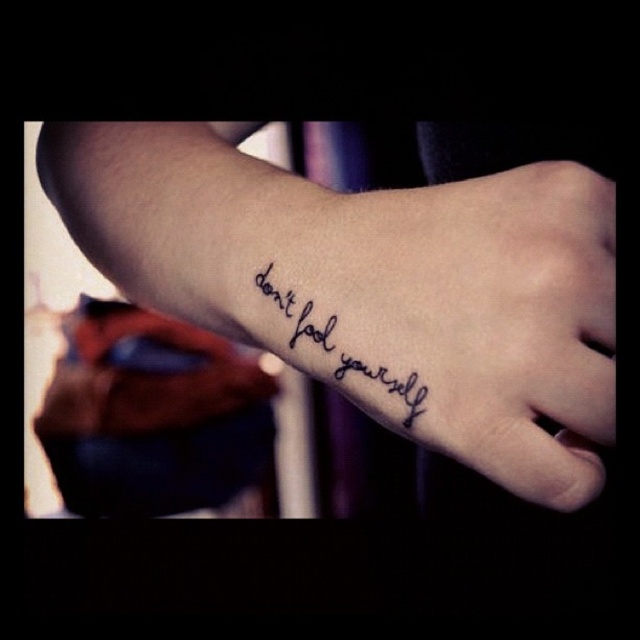
How distant is black ink tattoo at lower center from black ink text at lower left?

A distance of 1.41 inches exists between black ink tattoo at lower center and black ink text at lower left.

Describe the element at coordinates (456, 314) in the screenshot. This screenshot has height=640, width=640. I see `black ink tattoo at lower center` at that location.

This screenshot has width=640, height=640. Find the location of `black ink tattoo at lower center`. black ink tattoo at lower center is located at coordinates (456, 314).